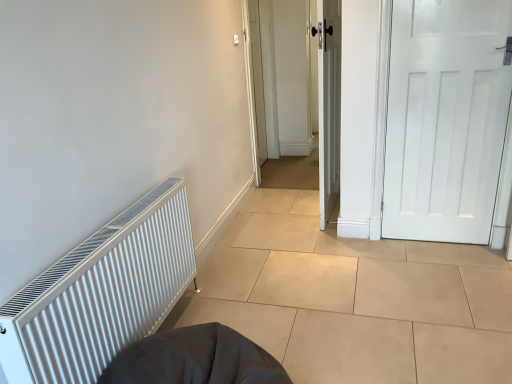
Question: Is white ribbed radiator at left in contact with white matte radiator at left?

Choices:
 (A) yes
 (B) no

Answer: (B)

Question: Can you confirm if white ribbed radiator at left is positioned to the left of white matte radiator at left?

Choices:
 (A) yes
 (B) no

Answer: (A)

Question: Can we say white ribbed radiator at left lies outside white matte radiator at left?

Choices:
 (A) no
 (B) yes

Answer: (B)

Question: Does white ribbed radiator at left have a smaller size compared to white matte radiator at left?

Choices:
 (A) no
 (B) yes

Answer: (B)

Question: Is white ribbed radiator at left wider than white matte radiator at left?

Choices:
 (A) no
 (B) yes

Answer: (A)

Question: Considering the relative positions of white ribbed radiator at left and white matte radiator at left in the image provided, is white ribbed radiator at left behind white matte radiator at left?

Choices:
 (A) no
 (B) yes

Answer: (A)

Question: Does white ribbed radiator at left come behind white matte door at right, arranged as the 1th door when viewed from the right?

Choices:
 (A) no
 (B) yes

Answer: (A)

Question: Can we say white ribbed radiator at left lies outside white matte door at right, which appears as the 2th door when viewed from the left?

Choices:
 (A) yes
 (B) no

Answer: (A)

Question: Is there a large distance between white ribbed radiator at left and white matte door at right, arranged as the 1th door when viewed from the right?

Choices:
 (A) yes
 (B) no

Answer: (A)

Question: Is white ribbed radiator at left at the left side of white matte door at right, arranged as the 1th door when viewed from the right?

Choices:
 (A) yes
 (B) no

Answer: (A)

Question: From the image's perspective, would you say white ribbed radiator at left is shown under white matte door at right, arranged as the 1th door when viewed from the right?

Choices:
 (A) yes
 (B) no

Answer: (A)

Question: Is white ribbed radiator at left at the right side of white matte door at right, arranged as the 1th door when viewed from the right?

Choices:
 (A) yes
 (B) no

Answer: (B)

Question: From the image's perspective, is white matte radiator at left located above white wooden door at center, marked as the second door in a right-to-left arrangement?

Choices:
 (A) no
 (B) yes

Answer: (A)